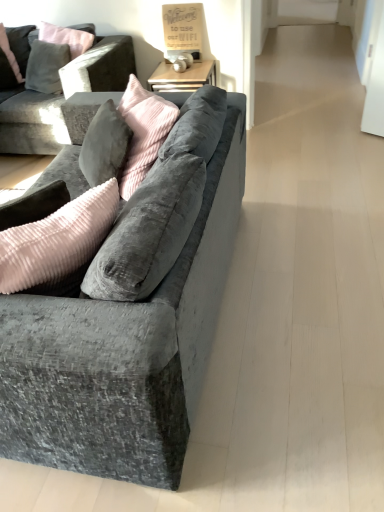
I want to click on velvet grey couch at upper left, which is counted as the first studio couch, starting from the top, so click(40, 122).

Can you confirm if velvet gray pillow at upper left is wider than velvet grey couch at left, the second studio couch viewed from the top?

No.

Is velvet gray pillow at upper left positioned with its back to velvet grey couch at left, the first studio couch from the bottom?

No, velvet gray pillow at upper left is not facing away from velvet grey couch at left, the first studio couch from the bottom.

From the image's perspective, is velvet gray pillow at upper left under velvet grey couch at left, arranged as the first studio couch when viewed from the front?

No, from the image's perspective, velvet gray pillow at upper left is not beneath velvet grey couch at left, arranged as the first studio couch when viewed from the front.

From a real-world perspective, is velvet grey couch at left, arranged as the first studio couch when viewed from the front, positioned under velvet gray pillow at upper left based on gravity?

Yes.

Can you confirm if velvet grey couch at left, the first studio couch from the bottom, is smaller than velvet gray pillow at upper left?

No, velvet grey couch at left, the first studio couch from the bottom, is not smaller than velvet gray pillow at upper left.

Considering the points (94, 453) and (14, 28), which point is behind, point (94, 453) or point (14, 28)?

Point (14, 28)

Visually, is velvet grey couch at left, the first studio couch from the bottom, positioned to the left or to the right of velvet gray pillow at upper left?

velvet grey couch at left, the first studio couch from the bottom, is to the right of velvet gray pillow at upper left.

Which is in front, velvet grey couch at left, the second studio couch viewed from the top, or velvet grey couch at upper left, placed as the 2th studio couch when sorted from bottom to top?

Positioned in front is velvet grey couch at left, the second studio couch viewed from the top.

From their relative heights in the image, would you say velvet grey couch at left, placed as the 2th studio couch when sorted from back to front, is taller or shorter than velvet grey couch at upper left, which is counted as the first studio couch, starting from the top?

velvet grey couch at left, placed as the 2th studio couch when sorted from back to front, is shorter than velvet grey couch at upper left, which is counted as the first studio couch, starting from the top.

Which is more to the right, velvet grey couch at left, the first studio couch from the bottom, or velvet grey couch at upper left, which ranks as the 1th studio couch in back-to-front order?

velvet grey couch at left, the first studio couch from the bottom.

Where is `studio couch on the right of velvet grey couch at upper left, the second studio couch positioned from the front`? The image size is (384, 512). studio couch on the right of velvet grey couch at upper left, the second studio couch positioned from the front is located at coordinates (123, 352).

Is velvet grey couch at upper left, placed as the 2th studio couch when sorted from bottom to top, oriented away from velvet gray pillow at upper left?

Yes, velvet grey couch at upper left, placed as the 2th studio couch when sorted from bottom to top, is facing away from velvet gray pillow at upper left.

In the scene shown: Considering the relative sizes of velvet grey couch at upper left, the second studio couch positioned from the front, and velvet gray pillow at upper left in the image provided, is velvet grey couch at upper left, the second studio couch positioned from the front, shorter than velvet gray pillow at upper left?

No.

In the image, is velvet grey couch at upper left, the second studio couch positioned from the front, on the left side or the right side of velvet gray pillow at upper left?

In the image, velvet grey couch at upper left, the second studio couch positioned from the front, appears on the right side of velvet gray pillow at upper left.

Is velvet grey couch at upper left, the second studio couch positioned from the front, spatially inside velvet gray pillow at upper left, or outside of it?

velvet grey couch at upper left, the second studio couch positioned from the front, is spatially situated outside velvet gray pillow at upper left.

From the image's perspective, is velvet grey couch at upper left, which ranks as the 1th studio couch in back-to-front order, on velvet grey couch at left, arranged as the first studio couch when viewed from the front?

Yes, from the image's perspective, velvet grey couch at upper left, which ranks as the 1th studio couch in back-to-front order, is above velvet grey couch at left, arranged as the first studio couch when viewed from the front.

Can you confirm if velvet grey couch at upper left, which ranks as the 1th studio couch in back-to-front order, is wider than velvet grey couch at left, the first studio couch from the bottom?

In fact, velvet grey couch at upper left, which ranks as the 1th studio couch in back-to-front order, might be narrower than velvet grey couch at left, the first studio couch from the bottom.

How many degrees apart are the facing directions of velvet grey couch at upper left, the second studio couch positioned from the front, and velvet grey couch at left, arranged as the first studio couch when viewed from the front?

90.5 degrees separate the facing orientations of velvet grey couch at upper left, the second studio couch positioned from the front, and velvet grey couch at left, arranged as the first studio couch when viewed from the front.

Considering the sizes of velvet grey couch at upper left, the second studio couch positioned from the front, and velvet grey couch at left, the first studio couch from the bottom, in the image, is velvet grey couch at upper left, the second studio couch positioned from the front, taller or shorter than velvet grey couch at left, the first studio couch from the bottom,?

In the image, velvet grey couch at upper left, the second studio couch positioned from the front, appears to be taller than velvet grey couch at left, the first studio couch from the bottom.

Considering the positions of objects velvet gray pillow at upper left and velvet grey couch at upper left, placed as the 2th studio couch when sorted from bottom to top, in the image provided, who is behind, velvet gray pillow at upper left or velvet grey couch at upper left, placed as the 2th studio couch when sorted from bottom to top,?

Positioned behind is velvet gray pillow at upper left.

Which object is thinner, velvet gray pillow at upper left or velvet grey couch at upper left, the second studio couch positioned from the front?

velvet gray pillow at upper left.

From the image's perspective, is velvet gray pillow at upper left below velvet grey couch at upper left, which is counted as the first studio couch, starting from the top?

Incorrect, from the image's perspective, velvet gray pillow at upper left is higher than velvet grey couch at upper left, which is counted as the first studio couch, starting from the top.

Would you say velvet gray pillow at upper left is outside velvet grey couch at upper left, the second studio couch positioned from the front?

No, most part of velvet gray pillow at upper left lies within velvet grey couch at upper left, the second studio couch positioned from the front.

Locate an element on the screen. the 2nd studio couch below the velvet gray pillow at upper left (from a real-world perspective) is located at coordinates (123, 352).

From the velvet gray pillow at upper left, count 2nd studio couchs forward and point to it. Please provide its 2D coordinates.

[(123, 352)]

Looking at the image, which one is located further to velvet gray pillow at upper left, velvet grey couch at upper left, the second studio couch positioned from the front, or velvet grey couch at left, arranged as the first studio couch when viewed from the front?

Based on the image, velvet grey couch at left, arranged as the first studio couch when viewed from the front, appears to be further to velvet gray pillow at upper left.

Estimate the real-world distances between objects in this image. Which object is further from velvet grey couch at upper left, placed as the 2th studio couch when sorted from bottom to top, velvet grey couch at left, arranged as the first studio couch when viewed from the front, or velvet gray pillow at upper left?

The object further to velvet grey couch at upper left, placed as the 2th studio couch when sorted from bottom to top, is velvet grey couch at left, arranged as the first studio couch when viewed from the front.

Looking at the image, which one is located closer to velvet grey couch at left, arranged as the first studio couch when viewed from the front, velvet grey couch at upper left, placed as the 2th studio couch when sorted from bottom to top, or velvet gray pillow at upper left?

Among the two, velvet grey couch at upper left, placed as the 2th studio couch when sorted from bottom to top, is located nearer to velvet grey couch at left, arranged as the first studio couch when viewed from the front.

Based on their spatial positions, is velvet grey couch at left, placed as the 2th studio couch when sorted from back to front, or velvet grey couch at upper left, which is counted as the first studio couch, starting from the top, closer to velvet gray pillow at upper left?

Among the two, velvet grey couch at upper left, which is counted as the first studio couch, starting from the top, is located nearer to velvet gray pillow at upper left.

Looking at the image, which one is located closer to velvet grey couch at upper left, which ranks as the 1th studio couch in back-to-front order, velvet gray pillow at upper left or velvet grey couch at left, arranged as the first studio couch when viewed from the front?

velvet gray pillow at upper left lies closer to velvet grey couch at upper left, which ranks as the 1th studio couch in back-to-front order, than the other object.

Considering their positions, is velvet gray pillow at upper left positioned closer to velvet grey couch at left, arranged as the first studio couch when viewed from the front, than velvet grey couch at upper left, the second studio couch positioned from the front?

Among the two, velvet grey couch at upper left, the second studio couch positioned from the front, is located nearer to velvet grey couch at left, arranged as the first studio couch when viewed from the front.

Locate an element on the screen. studio couch located between velvet grey couch at left, placed as the 2th studio couch when sorted from back to front, and velvet gray pillow at upper left in the depth direction is located at coordinates (40, 122).